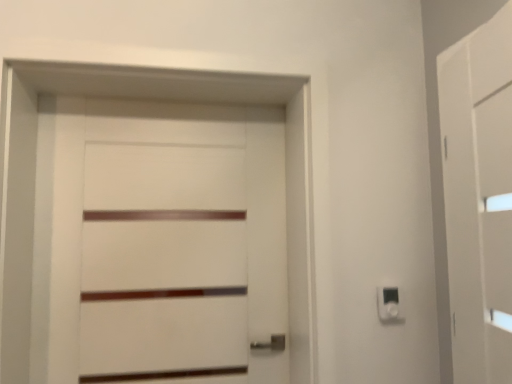
Question: From the image's perspective, is white matte barn door at right located beneath white plastic light switch at lower right?

Choices:
 (A) yes
 (B) no

Answer: (B)

Question: Can you confirm if white matte barn door at right is shorter than white plastic light switch at lower right?

Choices:
 (A) yes
 (B) no

Answer: (B)

Question: Can we say white matte barn door at right lies outside white plastic light switch at lower right?

Choices:
 (A) no
 (B) yes

Answer: (B)

Question: Is white matte barn door at right at the left side of white plastic light switch at lower right?

Choices:
 (A) yes
 (B) no

Answer: (B)

Question: Considering the relative sizes of white matte barn door at right and white plastic light switch at lower right in the image provided, is white matte barn door at right smaller than white plastic light switch at lower right?

Choices:
 (A) yes
 (B) no

Answer: (B)

Question: From a real-world perspective, is white matte barn door at right positioned above or below white plastic light switch at lower right?

Choices:
 (A) below
 (B) above

Answer: (B)

Question: Is point (456, 125) closer or farther from the camera than point (395, 311)?

Choices:
 (A) closer
 (B) farther

Answer: (A)

Question: In terms of width, does white matte barn door at right look wider or thinner when compared to white plastic light switch at lower right?

Choices:
 (A) wide
 (B) thin

Answer: (A)

Question: In the image, is white matte barn door at right on the left side or the right side of white plastic light switch at lower right?

Choices:
 (A) right
 (B) left

Answer: (A)

Question: Considering the positions of white matte barn door at right and white matte door at center in the image, is white matte barn door at right wider or thinner than white matte door at center?

Choices:
 (A) thin
 (B) wide

Answer: (B)

Question: Relative to white matte door at center, is white matte barn door at right in front or behind?

Choices:
 (A) behind
 (B) front

Answer: (B)

Question: From a real-world perspective, relative to white matte door at center, is white matte barn door at right vertically above or below?

Choices:
 (A) below
 (B) above

Answer: (B)

Question: Based on their sizes in the image, would you say white matte barn door at right is bigger or smaller than white matte door at center?

Choices:
 (A) big
 (B) small

Answer: (A)

Question: Based on their positions, is white plastic light switch at lower right located to the left or right of white matte door at center?

Choices:
 (A) left
 (B) right

Answer: (B)

Question: Does point (380, 299) appear closer or farther from the camera than point (284, 314)?

Choices:
 (A) farther
 (B) closer

Answer: (B)